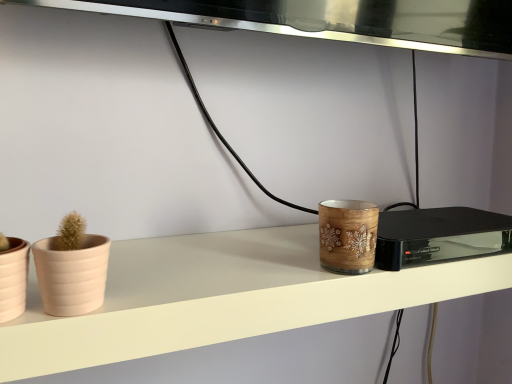
You are a GUI agent. You are given a task and a screenshot of the screen. Output one action in this format:
    pyautogui.click(x=<x>, y=<y>)
    Task: Click on the free space above wooden candle holder at center (from a real-world perspective)
    The height and width of the screenshot is (384, 512).
    Given the screenshot: What is the action you would take?
    (x=248, y=256)